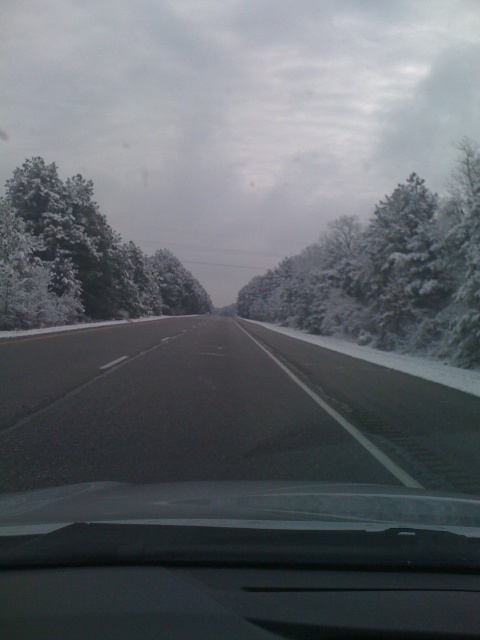
Is snow-covered evergreen at center wider than white frosty trees at left?

Yes, snow-covered evergreen at center is wider than white frosty trees at left.

Is point (397, 244) farther from viewer compared to point (20, 292)?

No, (397, 244) is closer to viewer.

Where is `snow-covered evergreen at center`? The height and width of the screenshot is (640, 480). snow-covered evergreen at center is located at coordinates (388, 273).

Which is in front, point (381, 468) or point (163, 300)?

Point (381, 468) is in front.

Who is lower down, black asphalt highway at center or white frosty trees at left?

Positioned lower is black asphalt highway at center.

Which is in front, point (151, 465) or point (43, 250)?

Point (151, 465)

The height and width of the screenshot is (640, 480). What are the coordinates of `black asphalt highway at center` in the screenshot? It's located at (222, 410).

The image size is (480, 640). What do you see at coordinates (222, 410) in the screenshot? I see `black asphalt highway at center` at bounding box center [222, 410].

Can you confirm if black asphalt highway at center is positioned to the left of snow-covered evergreen at center?

Correct, you'll find black asphalt highway at center to the left of snow-covered evergreen at center.

This screenshot has height=640, width=480. Identify the location of black asphalt highway at center. (222, 410).